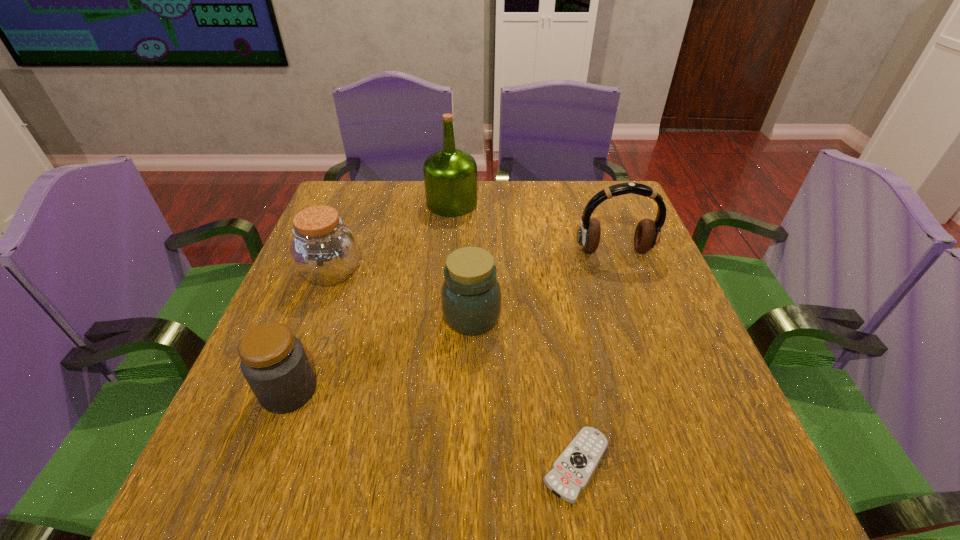
The height and width of the screenshot is (540, 960). Identify the location of vacant region between the remote control and the rightmost jar. (524, 391).

Where is `vacant space that's between the remote control and the rightmost jar`? vacant space that's between the remote control and the rightmost jar is located at coordinates (524, 391).

Where is `object that is the second closest to the rightmost jar`? The width and height of the screenshot is (960, 540). object that is the second closest to the rightmost jar is located at coordinates (571, 472).

Find the location of a particular element. The height and width of the screenshot is (540, 960). object that stands as the third closest to the third nearest object is located at coordinates (273, 361).

You are a GUI agent. You are given a task and a screenshot of the screen. Output one action in this format:
    pyautogui.click(x=<x>, y=<y>)
    Task: Click on the closest jar to the farthest object
    The height and width of the screenshot is (540, 960).
    Given the screenshot: What is the action you would take?
    pyautogui.click(x=324, y=250)

Where is `jar that is the third closest one to the rightmost object`? The image size is (960, 540). jar that is the third closest one to the rightmost object is located at coordinates (273, 361).

Locate an element on the screen. free space that satisfies the following two spatial constraints: 1. on the back side of the olive oil; 2. on the right side of the farthest jar is located at coordinates click(x=358, y=203).

Find the location of a particular element. The height and width of the screenshot is (540, 960). free location that satisfies the following two spatial constraints: 1. on the ear cup of the second tallest object; 2. on the surface of the nearest jar near the warning symbol is located at coordinates (665, 391).

Find the location of a particular element. free region that satisfies the following two spatial constraints: 1. on the surface of the fifth farthest object near the warning symbol; 2. on the back side of the fifth object from left to right is located at coordinates (261, 465).